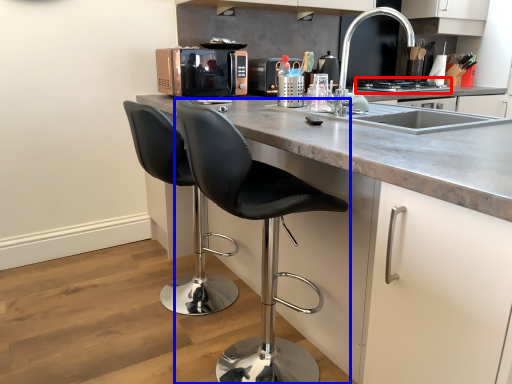
Question: Which object appears closest to the camera in this image, stove (highlighted by a red box) or chair (highlighted by a blue box)?

Choices:
 (A) stove
 (B) chair

Answer: (B)